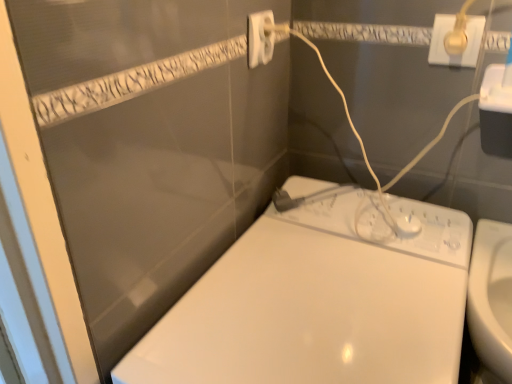
Question: Can you confirm if white glossy toilet at lower right is positioned to the left of white plastic power plug at upper center, positioned as the first power plugs and sockets in left-to-right order?

Choices:
 (A) no
 (B) yes

Answer: (A)

Question: Does white glossy toilet at lower right lie behind white plastic power plug at upper center, which appears as the 2th power plugs and sockets when viewed from the right?

Choices:
 (A) yes
 (B) no

Answer: (B)

Question: Is white glossy toilet at lower right shorter than white plastic power plug at upper center, positioned as the first power plugs and sockets in left-to-right order?

Choices:
 (A) yes
 (B) no

Answer: (B)

Question: From a real-world perspective, does white glossy toilet at lower right stand above white plastic power plug at upper center, positioned as the first power plugs and sockets in left-to-right order?

Choices:
 (A) yes
 (B) no

Answer: (B)

Question: Is white glossy toilet at lower right turned away from white plastic power plug at upper center, which appears as the 2th power plugs and sockets when viewed from the right?

Choices:
 (A) yes
 (B) no

Answer: (B)

Question: Is white glossy toilet at lower right wider or thinner than white plastic power plug at upper center, which appears as the 2th power plugs and sockets when viewed from the right?

Choices:
 (A) thin
 (B) wide

Answer: (B)

Question: Is white glossy toilet at lower right taller or shorter than white plastic power plug at upper center, which appears as the 2th power plugs and sockets when viewed from the right?

Choices:
 (A) short
 (B) tall

Answer: (B)

Question: Is white glossy toilet at lower right bigger or smaller than white plastic power plug at upper center, positioned as the first power plugs and sockets in left-to-right order?

Choices:
 (A) small
 (B) big

Answer: (B)

Question: Do you think white glossy toilet at lower right is within white plastic power plug at upper center, which appears as the 2th power plugs and sockets when viewed from the right, or outside of it?

Choices:
 (A) outside
 (B) inside

Answer: (A)

Question: From their relative heights in the image, would you say gold metallic plug at upper right, which appears as the first power plugs and sockets when viewed from the right, is taller or shorter than white glossy toilet at lower right?

Choices:
 (A) short
 (B) tall

Answer: (A)

Question: From the image's perspective, is gold metallic plug at upper right, which appears as the first power plugs and sockets when viewed from the right, located above or below white glossy toilet at lower right?

Choices:
 (A) above
 (B) below

Answer: (A)

Question: Is gold metallic plug at upper right, which appears as the first power plugs and sockets when viewed from the right, in front of or behind white glossy toilet at lower right in the image?

Choices:
 (A) behind
 (B) front

Answer: (A)

Question: Considering the positions of point (466, 29) and point (318, 188), is point (466, 29) closer or farther from the camera than point (318, 188)?

Choices:
 (A) farther
 (B) closer

Answer: (B)

Question: Choose the correct answer: Is gold metallic plug at upper right, which appears as the first power plugs and sockets when viewed from the right, inside white plastic power plug at upper center, which appears as the 2th power plugs and sockets when viewed from the right, or outside it?

Choices:
 (A) outside
 (B) inside

Answer: (A)

Question: Considering the positions of gold metallic plug at upper right, which appears as the first power plugs and sockets when viewed from the right, and white plastic power plug at upper center, positioned as the first power plugs and sockets in left-to-right order, in the image, is gold metallic plug at upper right, which appears as the first power plugs and sockets when viewed from the right, taller or shorter than white plastic power plug at upper center, positioned as the first power plugs and sockets in left-to-right order,?

Choices:
 (A) tall
 (B) short

Answer: (B)